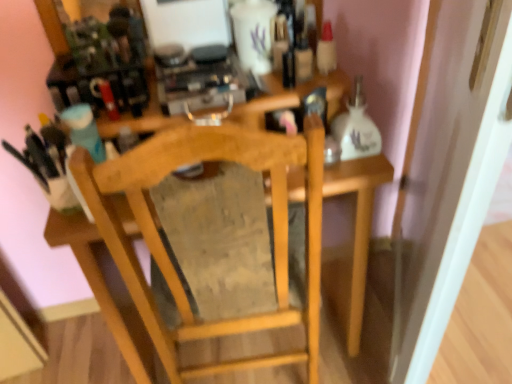
The width and height of the screenshot is (512, 384). What are the coordinates of `white glossy door at right` in the screenshot? It's located at (462, 190).

What do you see at coordinates (462, 190) in the screenshot? This screenshot has width=512, height=384. I see `white glossy door at right` at bounding box center [462, 190].

What is the approximate width of white glossy door at right?

It is 3.72 inches.

Measure the distance between wooden chair at center and camera.

wooden chair at center and camera are 22.42 inches apart.

Locate an element on the screen. The height and width of the screenshot is (384, 512). wooden chair at center is located at coordinates (166, 251).

The width and height of the screenshot is (512, 384). What do you see at coordinates (166, 251) in the screenshot? I see `wooden chair at center` at bounding box center [166, 251].

This screenshot has width=512, height=384. Identify the location of white glossy door at right. (462, 190).

Which is more to the left, wooden chair at center or white glossy door at right?

Positioned to the left is wooden chair at center.

Relative to white glossy door at right, is wooden chair at center in front or behind?

Clearly, wooden chair at center is behind white glossy door at right.

Considering the points (216, 154) and (492, 123), which point is in front, point (216, 154) or point (492, 123)?

Point (492, 123)

From the image's perspective, which is above, wooden chair at center or white glossy door at right?

→ white glossy door at right.

From a real-world perspective, who is located higher, wooden chair at center or white glossy door at right?

white glossy door at right, from a real-world perspective.

Which object is wider, wooden chair at center or white glossy door at right?

wooden chair at center is wider.

Is wooden chair at center shorter than white glossy door at right?

Correct, wooden chair at center is not as tall as white glossy door at right.

Considering the relative sizes of wooden chair at center and white glossy door at right in the image provided, is wooden chair at center bigger than white glossy door at right?

Indeed, wooden chair at center has a larger size compared to white glossy door at right.

Is wooden chair at center located outside white glossy door at right?

Indeed, wooden chair at center is completely outside white glossy door at right.

Does wooden chair at center touch white glossy door at right?

There is a gap between wooden chair at center and white glossy door at right.

Is wooden chair at center oriented towards white glossy door at right?

No, wooden chair at center does not turn towards white glossy door at right.

At what (x,y) coordinates should I click in order to perform the action: click on chair on the left of white glossy door at right. Please return your answer as a coordinate pair (x, y). The width and height of the screenshot is (512, 384). Looking at the image, I should click on (166, 251).

Considering the relative positions of white glossy door at right and wooden chair at center in the image provided, is white glossy door at right to the left or to the right of wooden chair at center?

Based on their positions, white glossy door at right is located to the right of wooden chair at center.

Is white glossy door at right positioned behind wooden chair at center?

No, white glossy door at right is in front of wooden chair at center.

Does point (442, 305) appear closer or farther from the camera than point (275, 358)?

Clearly, point (442, 305) is closer to the camera than point (275, 358).

From the image's perspective, which one is positioned higher, white glossy door at right or wooden chair at center?

white glossy door at right is shown above in the image.

From a real-world perspective, which object rests below the other?

wooden chair at center, from a real-world perspective.

Considering the sizes of white glossy door at right and wooden chair at center in the image, is white glossy door at right wider or thinner than wooden chair at center?

Considering their sizes, white glossy door at right looks slimmer than wooden chair at center.

Is white glossy door at right taller than wooden chair at center?

Yes, white glossy door at right is taller than wooden chair at center.

Looking at this image, who is smaller, white glossy door at right or wooden chair at center?

white glossy door at right is smaller.

Would you say white glossy door at right is outside wooden chair at center?

white glossy door at right lies outside wooden chair at center's area.

Are white glossy door at right and wooden chair at center located far from each other?

white glossy door at right is near wooden chair at center, not far away.

Is white glossy door at right positioned with its back to wooden chair at center?

Absolutely, white glossy door at right is directed away from wooden chair at center.

What's the angular difference between white glossy door at right and wooden chair at center's facing directions?

There is a 64.4-degree angle between the facing directions of white glossy door at right and wooden chair at center.

This screenshot has height=384, width=512. Find the location of `door in front of the wooden chair at center`. door in front of the wooden chair at center is located at coordinates pos(462,190).

Locate an element on the screen. The height and width of the screenshot is (384, 512). door above the wooden chair at center (from the image's perspective) is located at coordinates (462, 190).

The width and height of the screenshot is (512, 384). Identify the location of door above the wooden chair at center (from a real-world perspective). (x=462, y=190).